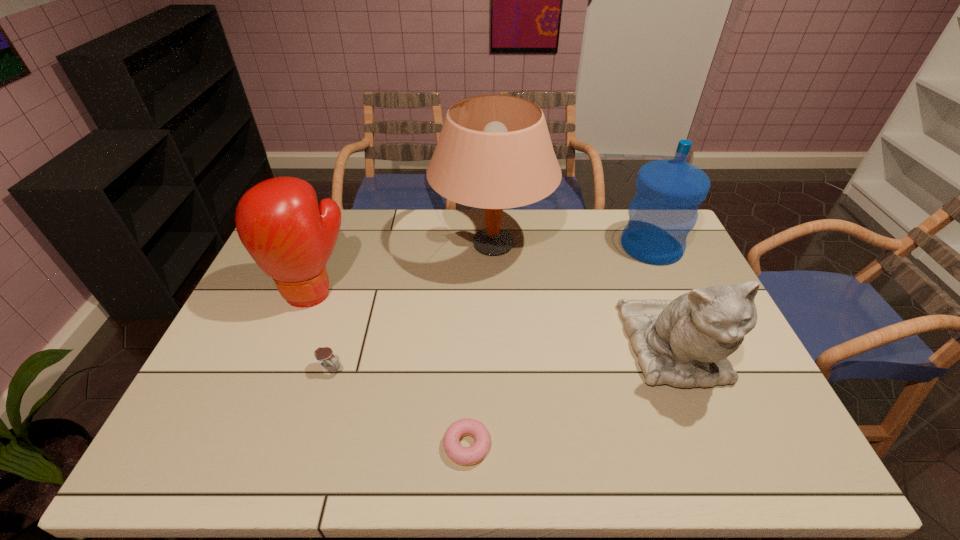
Find the location of a particular element. The width and height of the screenshot is (960, 540). blank area in the image that satisfies the following two spatial constraints: 1. on the front side of the second shortest object; 2. on the left side of the shortest object is located at coordinates (308, 446).